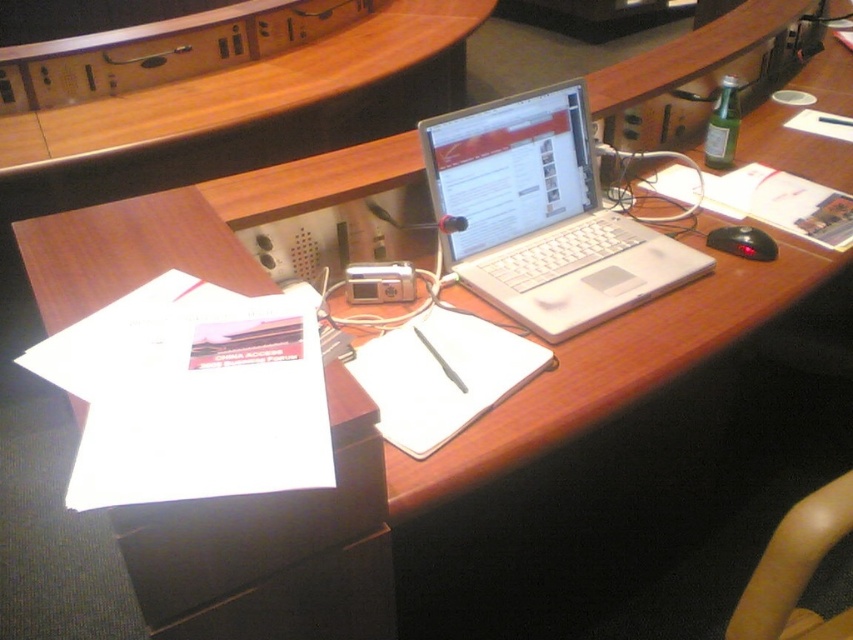
Question: Considering the real-world distances, which object is closest to the white paper at center?

Choices:
 (A) smooth beige armrest at lower right
 (B) wooden at center

Answer: (A)

Question: Is silver metallic laptop at center smaller than smooth beige armrest at lower right?

Choices:
 (A) yes
 (B) no

Answer: (B)

Question: Can you confirm if wooden at center is wider than smooth beige armrest at lower right?

Choices:
 (A) no
 (B) yes

Answer: (B)

Question: Is silver metallic laptop at center to the right of smooth beige armrest at lower right from the viewer's perspective?

Choices:
 (A) yes
 (B) no

Answer: (B)

Question: Which point is closer to the camera?

Choices:
 (A) (480, 193)
 (B) (726, 234)
 (C) (784, 608)

Answer: (C)

Question: Which point is farther from the camera taking this photo?

Choices:
 (A) (440, 436)
 (B) (543, 259)
 (C) (341, 45)

Answer: (C)